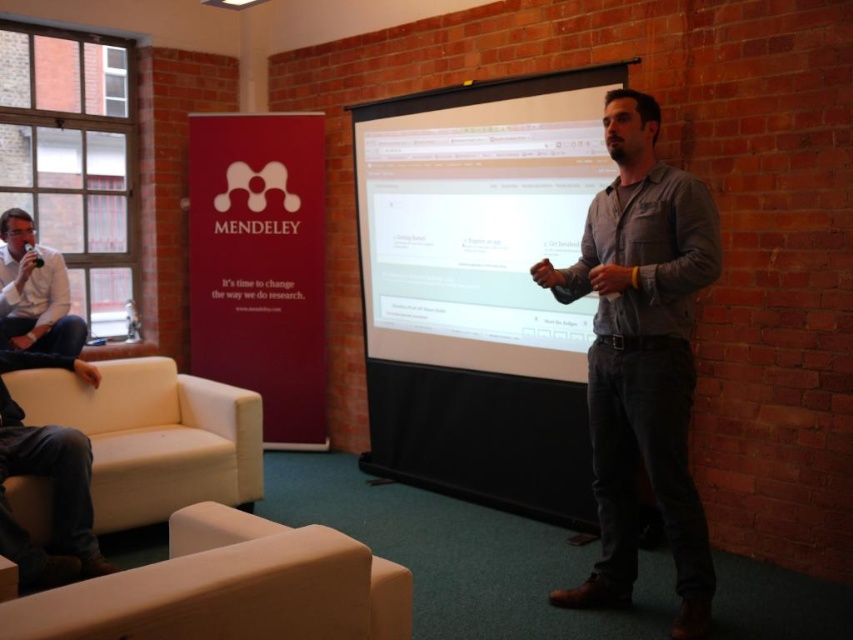
You are sitting in the white leather armchair at lower left and want to look at the person in the gray cotton shirt at center. In which direction should you turn your head?

You should turn your head to the right to look at the person in the gray cotton shirt at center, as the gray cotton shirt at center is to the right of the white leather armchair at lower left.